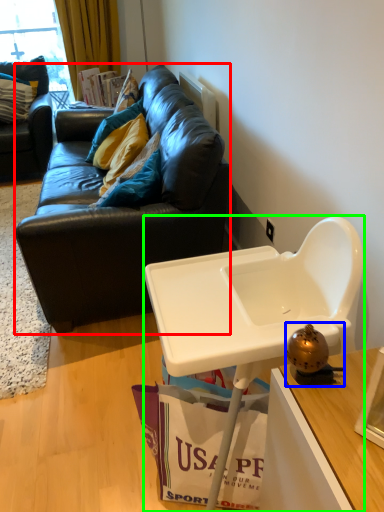
Question: Based on their relative distances, which object is nearer to studio couch (highlighted by a red box)? Choose from toy (highlighted by a blue box) and table (highlighted by a green box).

Choices:
 (A) toy
 (B) table

Answer: (B)